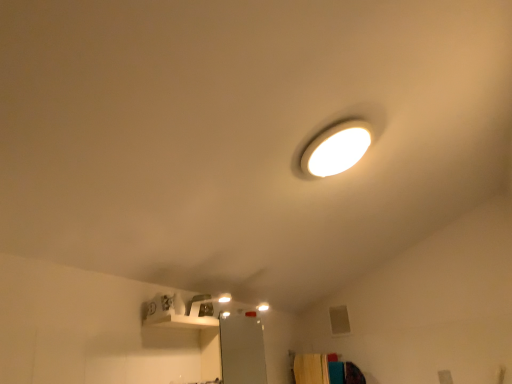
Question: From the image's perspective, is wooden cabinet at lower right located beneath white glossy lamp at upper center?

Choices:
 (A) yes
 (B) no

Answer: (A)

Question: Considering the relative sizes of wooden cabinet at lower right and white glossy lamp at upper center in the image provided, is wooden cabinet at lower right wider than white glossy lamp at upper center?

Choices:
 (A) yes
 (B) no

Answer: (A)

Question: Is wooden cabinet at lower right to the left of white glossy lamp at upper center from the viewer's perspective?

Choices:
 (A) yes
 (B) no

Answer: (B)

Question: Is wooden cabinet at lower right in front of white glossy lamp at upper center?

Choices:
 (A) no
 (B) yes

Answer: (A)

Question: From a real-world perspective, is wooden cabinet at lower right positioned under white glossy lamp at upper center based on gravity?

Choices:
 (A) yes
 (B) no

Answer: (A)

Question: Is wooden cabinet at lower right behind white glossy lamp at upper center?

Choices:
 (A) no
 (B) yes

Answer: (B)

Question: Does white glossy lamp at upper center appear on the right side of wooden cabinet at lower right?

Choices:
 (A) no
 (B) yes

Answer: (A)

Question: Can you confirm if white glossy lamp at upper center is thinner than wooden cabinet at lower right?

Choices:
 (A) yes
 (B) no

Answer: (A)

Question: Is the depth of white glossy lamp at upper center greater than that of wooden cabinet at lower right?

Choices:
 (A) yes
 (B) no

Answer: (B)

Question: Is white glossy lamp at upper center facing towards wooden cabinet at lower right?

Choices:
 (A) yes
 (B) no

Answer: (B)

Question: From a real-world perspective, is white glossy lamp at upper center positioned under wooden cabinet at lower right based on gravity?

Choices:
 (A) no
 (B) yes

Answer: (A)

Question: Considering the relative sizes of white glossy lamp at upper center and wooden cabinet at lower right in the image provided, is white glossy lamp at upper center smaller than wooden cabinet at lower right?

Choices:
 (A) no
 (B) yes

Answer: (B)

Question: In the image, is white glossy lamp at upper center positioned in front of or behind wooden cabinet at lower right?

Choices:
 (A) front
 (B) behind

Answer: (A)